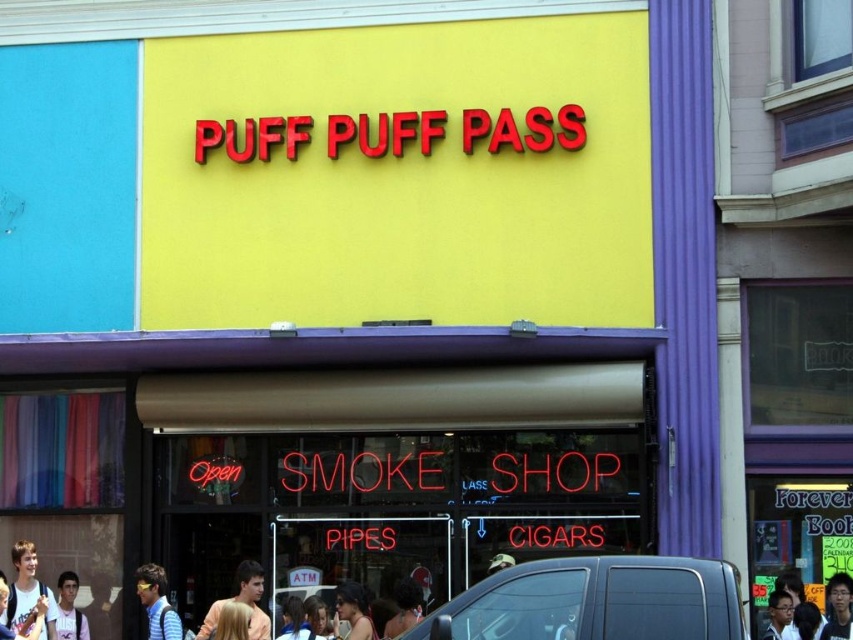
Question: Which point is farther to the camera?

Choices:
 (A) (202, 621)
 (B) (849, 632)
 (C) (16, 579)

Answer: (A)

Question: Which object appears farthest from the camera in this image?

Choices:
 (A) striped shirt at lower left
 (B) blonde hair at center
 (C) curly hair at center

Answer: (A)

Question: Can you confirm if blonde hair at center is positioned above smooth skin face at center?

Choices:
 (A) yes
 (B) no

Answer: (B)

Question: Which point is closer to the camera?

Choices:
 (A) (838, 593)
 (B) (770, 616)
 (C) (154, 572)
 (D) (482, 630)

Answer: (D)

Question: Does black glossy van at lower center appear on the right side of curly hair at center?

Choices:
 (A) yes
 (B) no

Answer: (A)

Question: Is the position of black glossy van at lower center less distant than that of striped shirt at lower left?

Choices:
 (A) no
 (B) yes

Answer: (B)